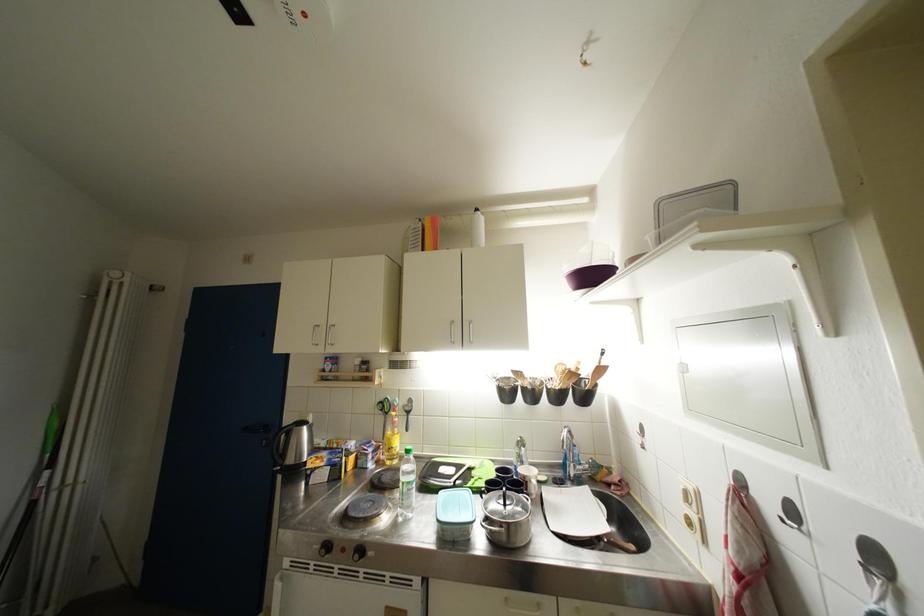
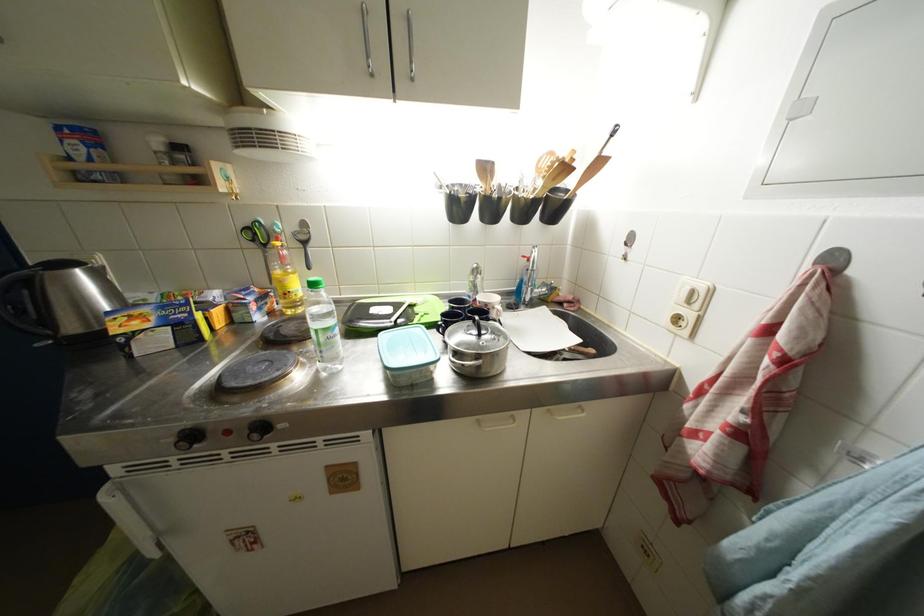
Where in the second image is the point corresponding to point 573,373 from the first image?

(565, 164)